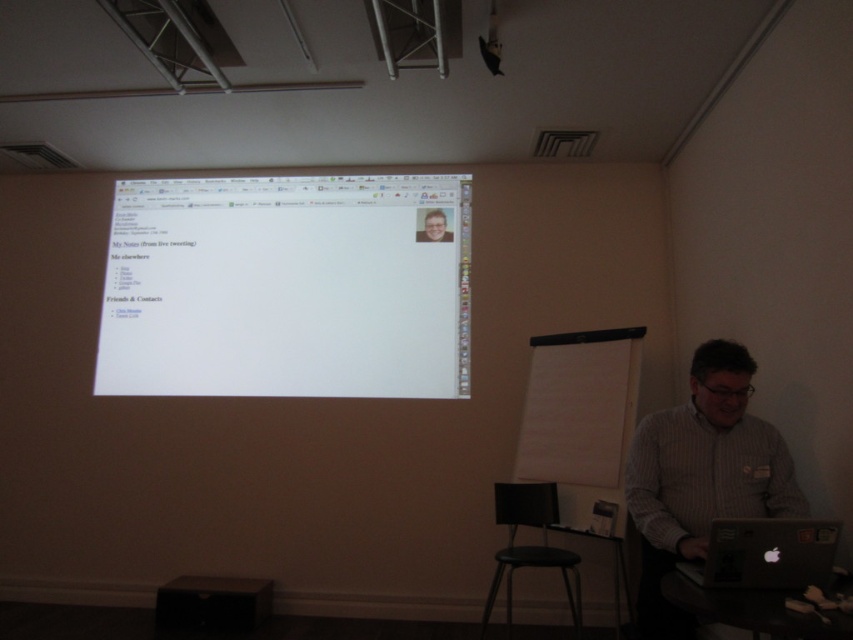
You are organizing a workshop and need to set up equipment. You have a silver metallic laptop at lower right and a light brown wooden desk at center. Which object should you place first if you want to ensure there is enough space for both?

You should place the silver metallic laptop at lower right first because it has a larger size compared to the light brown wooden desk at center, ensuring there is enough space for both.

You are a presenter who needs to adjust your notes. You are currently standing at the light brown wooden desk at center. To your right, there is a flip chart stand with a blank whiteboard. However, you need to step onto something to reach it. Is the black plastic stool at lower center positioned in a way that you can use it to reach the flip chart stand?

The black plastic stool at lower center is to the right of the light brown wooden desk at center, so it is positioned in a way that you can step onto it to reach the flip chart stand.

You are standing in the conference room and need to place a new laptop on the table next to the silver metallic laptop at lower right. Where should you place it to ensure it doesn not block the view of the projection screen?

Place the new laptop to the left side of the silver metallic laptop at lower right since the silver metallic laptop at lower right is positioned at point (764, 554), which is near the lower right corner, leaving space to the left for another laptop without blocking the screen.